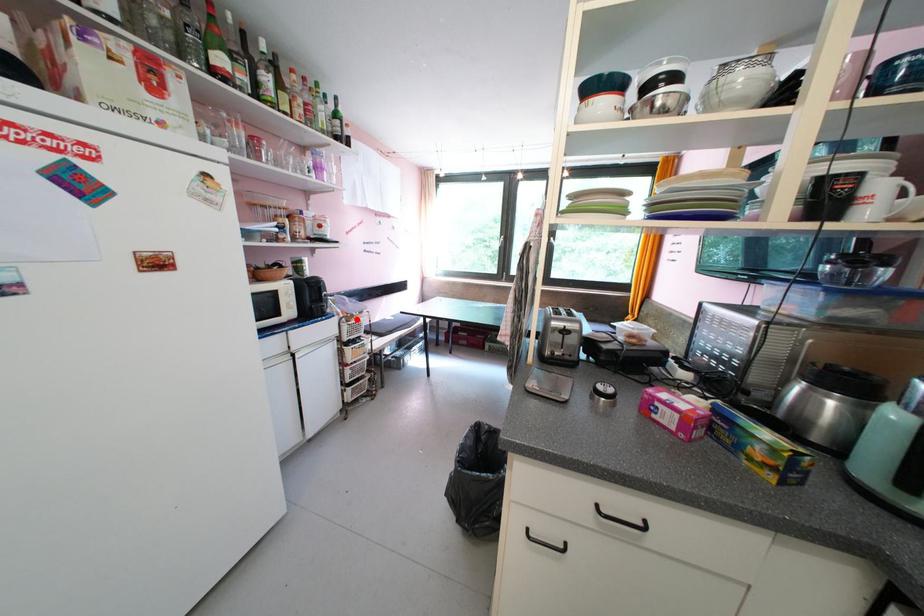
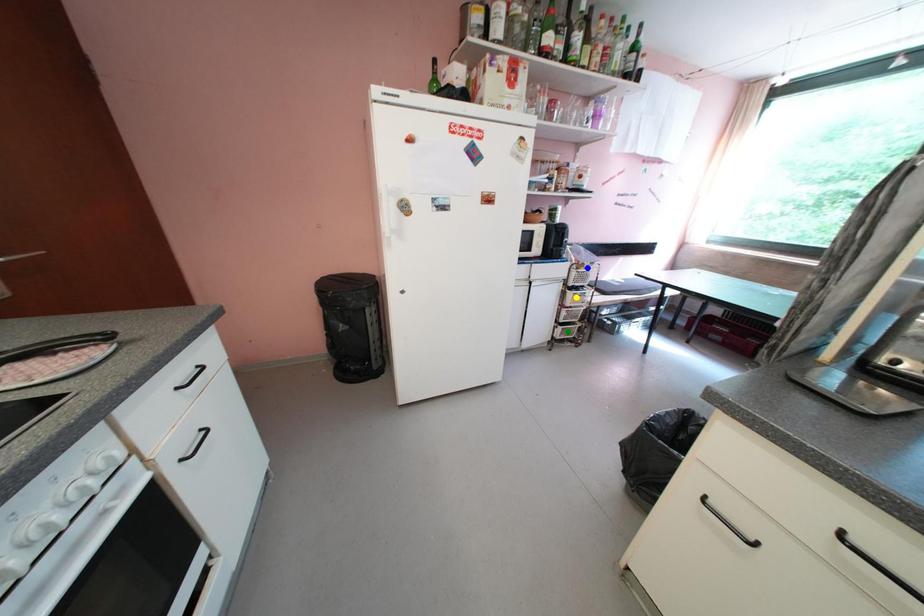
Question: I am providing you with two images of the same scene from different viewpoints. A red point is marked on the first image. You are given multiple points on the second image. Which spot in image 2 lines up with the point in image 1?

Choices:
 (A) blue point
 (B) green point
 (C) yellow point

Answer: (A)